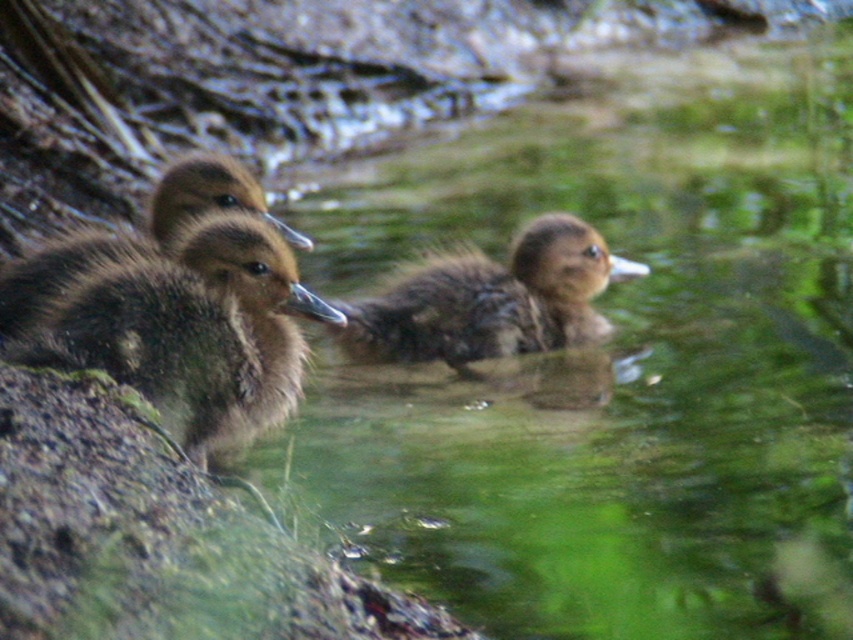
Question: Which object is farther from the camera taking this photo?

Choices:
 (A) brown fuzzy duckling at center
 (B) brown fuzzy duckling at left

Answer: (A)

Question: Can you confirm if brown fuzzy duckling at left is bigger than brown fuzzy duckling at center?

Choices:
 (A) yes
 (B) no

Answer: (A)

Question: Is brown fuzzy duckling at left closer to the viewer compared to brown fuzzy duckling at center?

Choices:
 (A) no
 (B) yes

Answer: (B)

Question: Can you confirm if brown fuzzy duckling at left is smaller than brown fuzzy duckling at center?

Choices:
 (A) no
 (B) yes

Answer: (A)